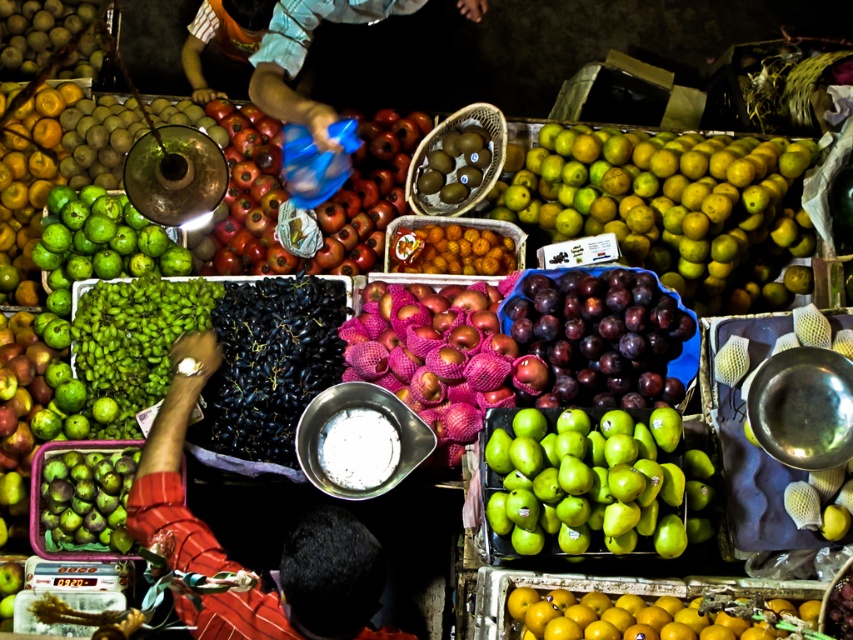
In the scene shown: Does green matte pears at center appear over green matte figs at lower left?

Yes.

Is green matte pears at center shorter than green matte figs at lower left?

No, green matte pears at center is not shorter than green matte figs at lower left.

Which is in front, point (509, 497) or point (102, 481)?

Point (509, 497)

Image resolution: width=853 pixels, height=640 pixels. Find the location of `green matte pears at center`. green matte pears at center is located at coordinates (595, 483).

Does red sleeve at center lie behind shiny brown kiwi at center?

No, red sleeve at center is closer to the viewer.

Is red sleeve at center to the left of shiny brown kiwi at center from the viewer's perspective?

Correct, you'll find red sleeve at center to the left of shiny brown kiwi at center.

You are a GUI agent. You are given a task and a screenshot of the screen. Output one action in this format:
    pyautogui.click(x=<x>, y=<y>)
    Task: Click on the red sleeve at center
    Image resolution: width=853 pixels, height=640 pixels.
    Given the screenshot: What is the action you would take?
    [x=306, y=586]

Is pink mesh bagged apples at center thinner than shiny brown kiwi at center?

No.

In the scene shown: Is pink mesh bagged apples at center to the left of shiny brown kiwi at center from the viewer's perspective?

Yes, pink mesh bagged apples at center is to the left of shiny brown kiwi at center.

Who is more forward, (386, 362) or (419, 177)?

Point (386, 362) is in front.

Locate an element on the screen. This screenshot has height=640, width=853. pink mesh bagged apples at center is located at coordinates (432, 362).